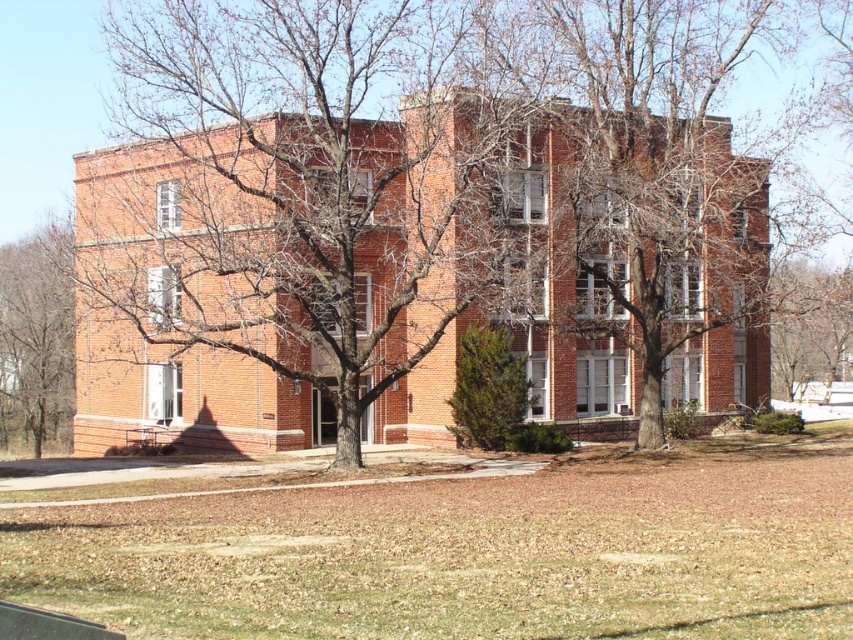
From the picture: You are standing in front of the two story brick building and want to take a photo of the brown bark tree at center and the bare branches at left. Which object will appear larger in the photo?

The brown bark tree at center will appear larger in the photo because it is in front of the bare branches at left, making it closer to the camera.

You are standing in front of the two story brick building. You see a brown bark tree at center and a bare branches at left. Which object is closer to you?

The brown bark tree at center is closer to you than the bare branches at left, since it is only 20.26 meters away from them.